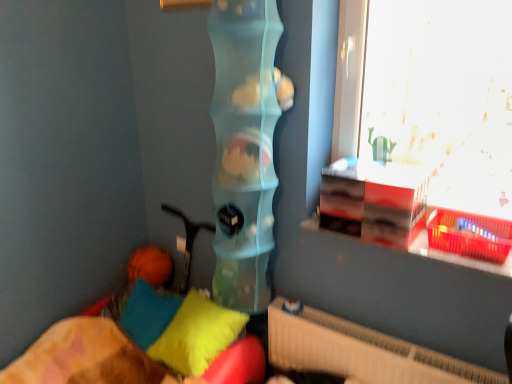
Question: From the image's perspective, is soft cotton pillow at lower left, which is the first pillow in left-to-right order, located above soft fabric pillows at lower left?

Choices:
 (A) yes
 (B) no

Answer: (A)

Question: Does soft cotton pillow at lower left, the 2th pillow in the right-to-left sequence, have a greater width compared to soft fabric pillows at lower left?

Choices:
 (A) yes
 (B) no

Answer: (B)

Question: Does soft cotton pillow at lower left, the 2th pillow in the right-to-left sequence, come behind soft fabric pillows at lower left?

Choices:
 (A) no
 (B) yes

Answer: (B)

Question: Is soft cotton pillow at lower left, the 2th pillow in the right-to-left sequence, thinner than soft fabric pillows at lower left?

Choices:
 (A) no
 (B) yes

Answer: (B)

Question: Is soft cotton pillow at lower left, which is the first pillow in left-to-right order, bigger than soft fabric pillows at lower left?

Choices:
 (A) no
 (B) yes

Answer: (A)

Question: Would you say transparent glass window at upper right is inside or outside white textured radiator at lower right?

Choices:
 (A) outside
 (B) inside

Answer: (A)

Question: Considering the positions of transparent glass window at upper right and white textured radiator at lower right in the image, is transparent glass window at upper right wider or thinner than white textured radiator at lower right?

Choices:
 (A) wide
 (B) thin

Answer: (A)

Question: Is transparent glass window at upper right bigger or smaller than white textured radiator at lower right?

Choices:
 (A) big
 (B) small

Answer: (A)

Question: Would you say transparent glass window at upper right is to the left or to the right of white textured radiator at lower right in the picture?

Choices:
 (A) right
 (B) left

Answer: (A)

Question: In the image, is soft cotton pillow at lower left, the 2th pillow in the right-to-left sequence, positioned in front of or behind white textured radiator at lower right?

Choices:
 (A) behind
 (B) front

Answer: (A)

Question: In terms of width, does soft cotton pillow at lower left, which is the first pillow in left-to-right order, look wider or thinner when compared to white textured radiator at lower right?

Choices:
 (A) wide
 (B) thin

Answer: (A)

Question: Considering the relative positions of soft cotton pillow at lower left, the 2th pillow in the right-to-left sequence, and white textured radiator at lower right in the image provided, is soft cotton pillow at lower left, the 2th pillow in the right-to-left sequence, to the left or to the right of white textured radiator at lower right?

Choices:
 (A) right
 (B) left

Answer: (B)

Question: From a real-world perspective, is soft cotton pillow at lower left, which is the first pillow in left-to-right order, above or below white textured radiator at lower right?

Choices:
 (A) above
 (B) below

Answer: (A)

Question: From a real-world perspective, relative to soft fabric pillows at lower left, is white textured radiator at lower right vertically above or below?

Choices:
 (A) below
 (B) above

Answer: (B)

Question: Relative to soft fabric pillows at lower left, is white textured radiator at lower right in front or behind?

Choices:
 (A) front
 (B) behind

Answer: (B)